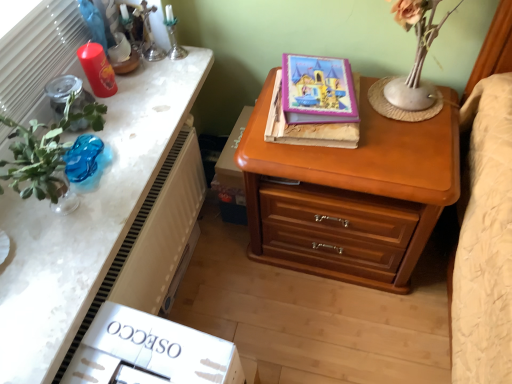
Locate an element on the screen. free location above wooden chest of drawers at right (from a real-world perspective) is located at coordinates (370, 128).